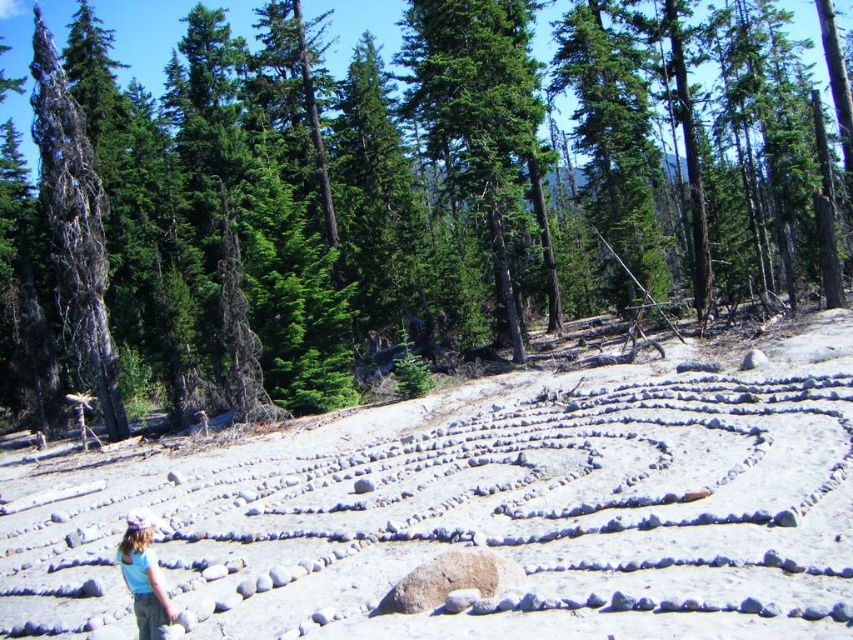
Question: Which object is positioned farthest from the light blue t-shirt at lower left?

Choices:
 (A) green evergreen tree at center
 (B) gray bark tree at left

Answer: (A)

Question: In this image, where is green evergreen tree at center located relative to green glossy tree at center?

Choices:
 (A) above
 (B) below

Answer: (A)

Question: Can you confirm if gray bark tree at left is thinner than light blue t-shirt at lower left?

Choices:
 (A) yes
 (B) no

Answer: (B)

Question: Which object is closer to the camera taking this photo?

Choices:
 (A) green glossy tree at center
 (B) light blue t-shirt at lower left
 (C) green evergreen tree at center

Answer: (B)

Question: Can you confirm if green evergreen tree at center is positioned to the left of green glossy tree at center?

Choices:
 (A) no
 (B) yes

Answer: (A)

Question: Which point is farther from the camera taking this photo?

Choices:
 (A) (741, 51)
 (B) (62, 109)
 (C) (137, 544)
 (D) (521, 38)

Answer: (A)